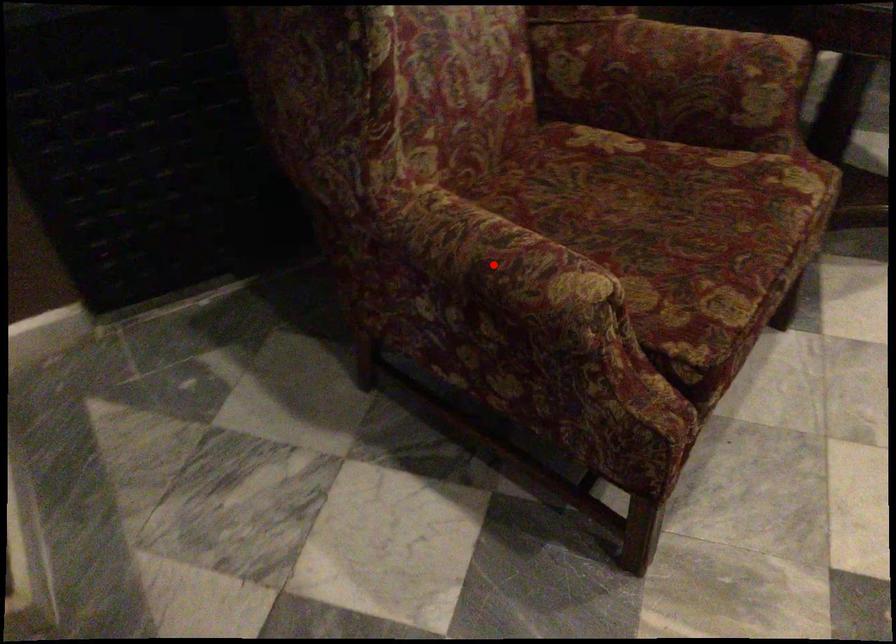
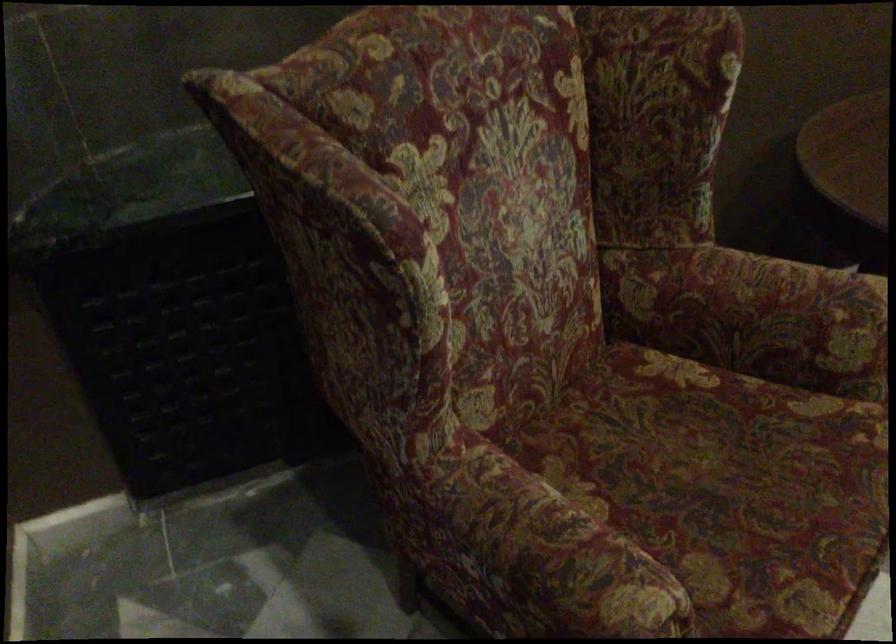
In the second image, find the point that corresponds to the highlighted location in the first image.

(543, 559)